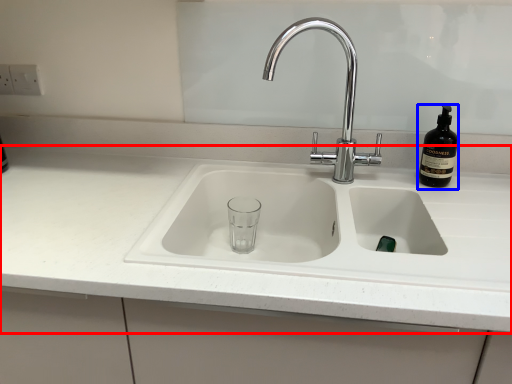
Question: Which object appears closest to the camera in this image, countertop (highlighted by a red box) or bottle (highlighted by a blue box)?

Choices:
 (A) countertop
 (B) bottle

Answer: (A)